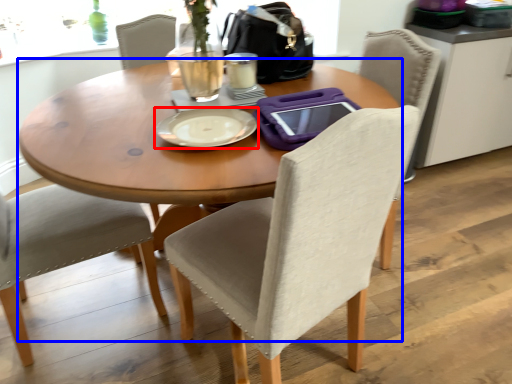
Question: Which of the following is the farthest to the observer, plate (highlighted by a red box) or kitchen & dining room table (highlighted by a blue box)?

Choices:
 (A) plate
 (B) kitchen & dining room table

Answer: (A)